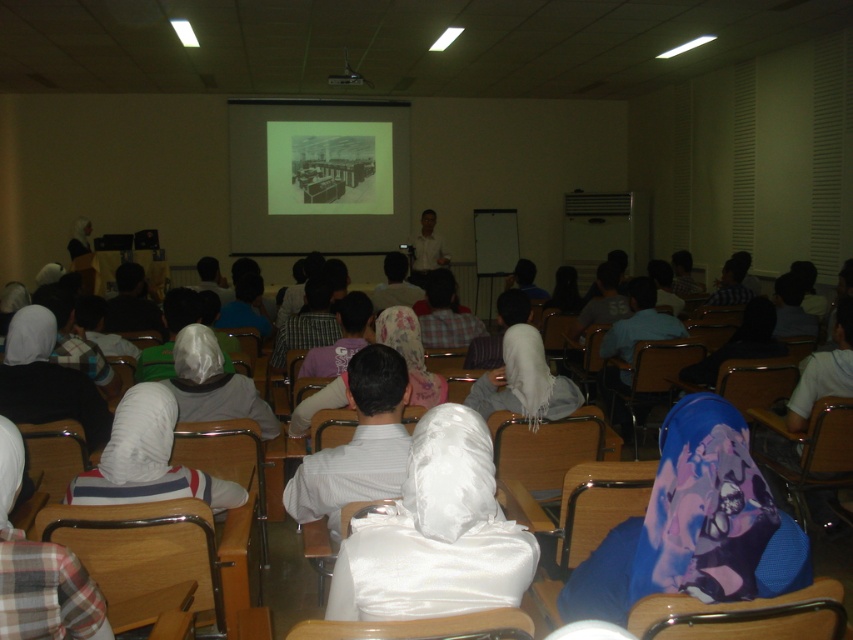
You are an event organizer who needs to ensure that all attendees have enough space in the classroom. You notice the plaid fabric shirt at lower left and the wooden chair at center. Which object takes up more space in the scene?

The plaid fabric shirt at lower left has a larger size compared to the wooden chair at center, so it takes up more space in the scene.

You are sitting in the front row of the classroom and want to look at both the point at coordinates point (50, 621) and the point at coordinates point (517, 612) on the projection screen. Which point will appear closer to you?

The point at coordinates point (50, 621) will appear closer to you because it is further to the viewer than the point at coordinates point (517, 612).